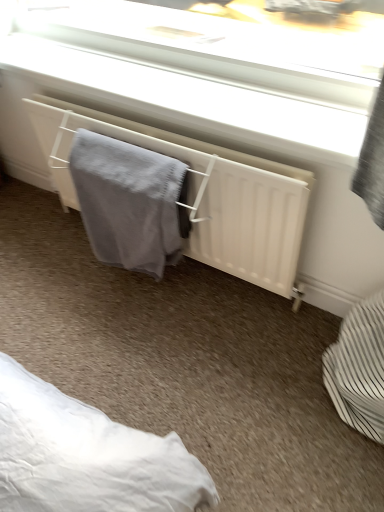
You are a GUI agent. You are given a task and a screenshot of the screen. Output one action in this format:
    pyautogui.click(x=<x>, y=<y>)
    Task: Click on the free region under gray knitted towel at center (from a real-world perspective)
    The image size is (384, 512).
    Given the screenshot: What is the action you would take?
    pyautogui.click(x=143, y=285)